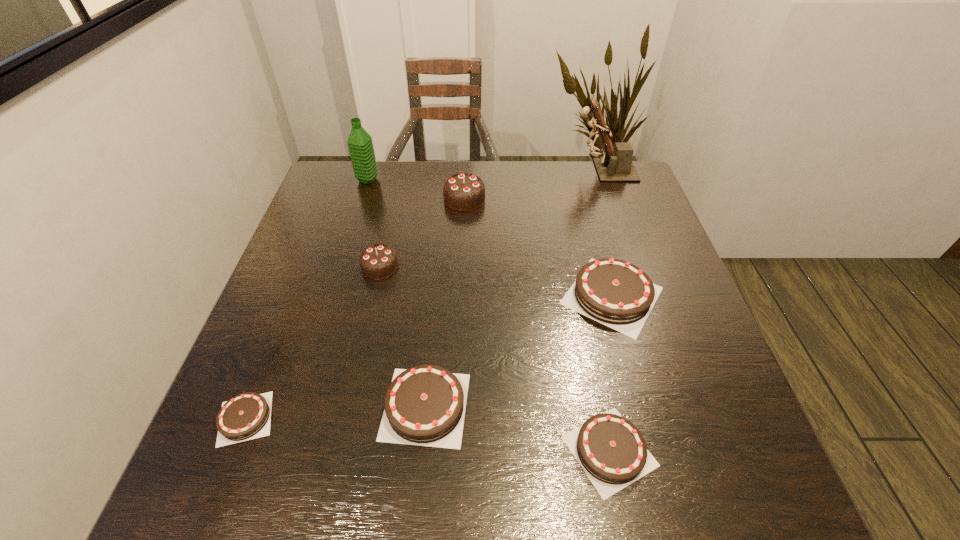
At what (x,y) coordinates should I click in order to perform the action: click on object that is the sixth closest to the seventh shortest object. Please return your answer as a coordinate pair (x, y). The image size is (960, 540). Looking at the image, I should click on coord(246,416).

Where is `chocolate cake that stands as the third closest to the second tallest object`? Image resolution: width=960 pixels, height=540 pixels. chocolate cake that stands as the third closest to the second tallest object is located at coordinates (618, 294).

At what (x,y) coordinates should I click in order to perform the action: click on the closest chocolate cake to the farthest brown chocolate cake. Please return your answer as a coordinate pair (x, y). Image resolution: width=960 pixels, height=540 pixels. Looking at the image, I should click on (611, 450).

Point out which brown chocolate cake is positioned as the second nearest to the tallest object. Please provide its 2D coordinates. Your answer should be formatted as a tuple, i.e. [(x, y)], where the tuple contains the x and y coordinates of a point satisfying the conditions above.

[(425, 405)]

In order to click on brown chocolate cake that is the fourth closest one to the bigger chocolate chocolate cake in this screenshot , I will do `click(246, 416)`.

This screenshot has height=540, width=960. I want to click on free point that satisfies the following two spatial constraints: 1. on the front-facing side of the brown figurine; 2. on the front side of the leftmost brown chocolate cake, so click(690, 418).

Identify the location of free spot that satisfies the following two spatial constraints: 1. on the front side of the second smallest brown chocolate cake; 2. on the right side of the third tallest object. (454, 451).